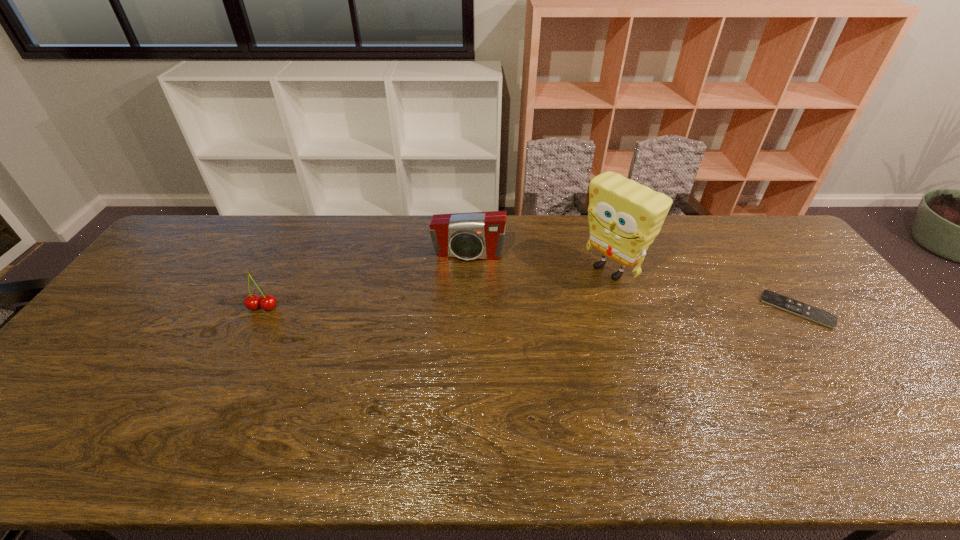
At what (x,y) coordinates should I click in order to perform the action: click on free area in between the sponge and the shortest object. Please return your answer as a coordinate pair (x, y). This screenshot has height=540, width=960. Looking at the image, I should click on (704, 290).

This screenshot has height=540, width=960. In order to click on free spot between the leftmost object and the rightmost object in this screenshot , I will do pos(530,308).

You are a GUI agent. You are given a task and a screenshot of the screen. Output one action in this format:
    pyautogui.click(x=<x>, y=<y>)
    Task: Click on the free space that is in between the remote control and the cherry
    This screenshot has width=960, height=540.
    Given the screenshot: What is the action you would take?
    pyautogui.click(x=530, y=308)

This screenshot has width=960, height=540. Find the location of `free spot between the leftmost object and the rightmost object`. free spot between the leftmost object and the rightmost object is located at coordinates (530, 308).

Identify the location of vacant space in between the shortest object and the sponge. This screenshot has width=960, height=540. pyautogui.click(x=704, y=290).

In order to click on the third closest object to the second object from right to left in this screenshot , I will do `click(268, 302)`.

The width and height of the screenshot is (960, 540). Find the location of `object that is the nearest to the third shortest object`. object that is the nearest to the third shortest object is located at coordinates (624, 217).

This screenshot has width=960, height=540. Identify the location of free region that satisfies the following two spatial constraints: 1. with the stems of the cherry pointing upwards; 2. on the left side of the remote control. (262, 309).

Locate an element on the screen. free region that satisfies the following two spatial constraints: 1. with the stems of the cherry pointing upwards; 2. on the right side of the rightmost object is located at coordinates (262, 309).

Find the location of `free space that satisfies the following two spatial constraints: 1. with the stems of the leftmost object pointing upwards; 2. on the left side of the rightmost object`. free space that satisfies the following two spatial constraints: 1. with the stems of the leftmost object pointing upwards; 2. on the left side of the rightmost object is located at coordinates (262, 309).